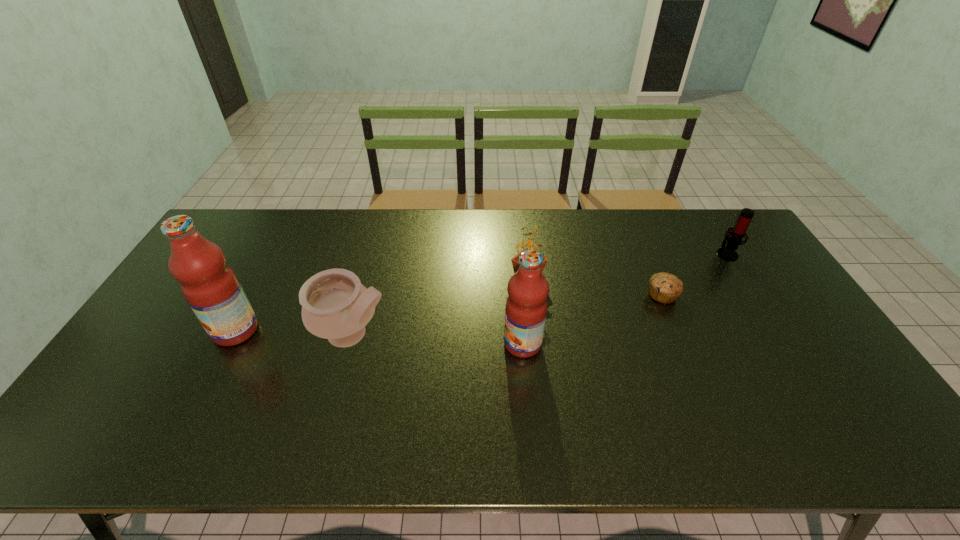
Find the location of `blank space located 0.080m on the front label of the leftmost object`. blank space located 0.080m on the front label of the leftmost object is located at coordinates (185, 330).

Image resolution: width=960 pixels, height=540 pixels. What are the coordinates of `blank area located on the front label of the shorter fruit juice` in the screenshot? It's located at (486, 344).

The width and height of the screenshot is (960, 540). I want to click on vacant space located on the front label of the shorter fruit juice, so click(438, 344).

At what (x,y) coordinates should I click in order to perform the action: click on vacant point located on the front label of the shorter fruit juice. Please return your answer as a coordinate pair (x, y). Looking at the image, I should click on [452, 344].

Locate an element on the screen. free space located 0.230m on the front of the microphone is located at coordinates (764, 312).

This screenshot has height=540, width=960. Identify the location of free space located 0.190m on the back of the muffin. (641, 246).

The height and width of the screenshot is (540, 960). I want to click on vacant region located 0.220m at the front of the sunflower with flowers visible, so click(x=441, y=279).

The height and width of the screenshot is (540, 960). I want to click on free location located at the front of the sunflower with flowers visible, so click(x=482, y=279).

At what (x,y) coordinates should I click in order to perform the action: click on free space located at the front of the sunflower with flowers visible. Please return your answer as a coordinate pair (x, y). Looking at the image, I should click on (450, 279).

The image size is (960, 540). Identify the location of vacant space located 0.190m on the right of the second object from left to right. (462, 335).